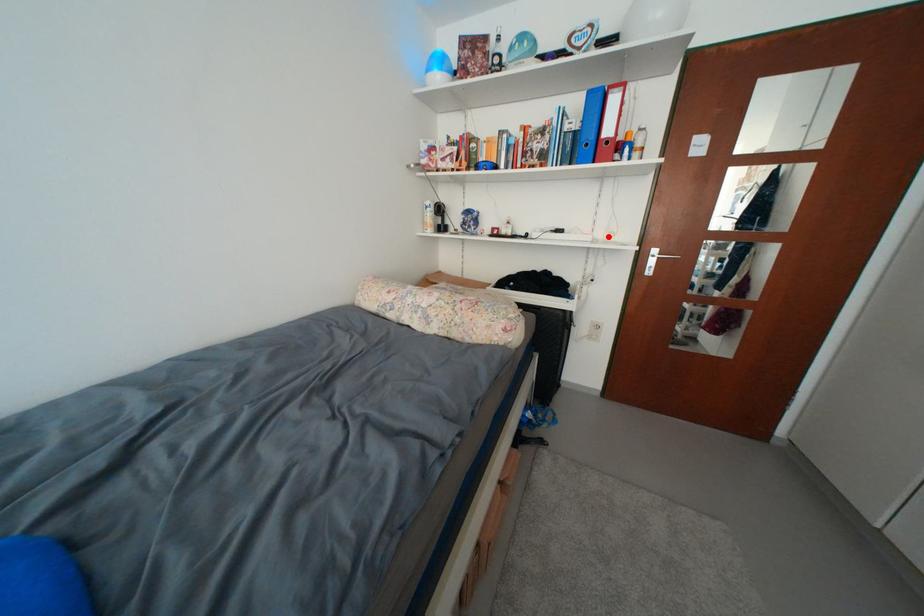
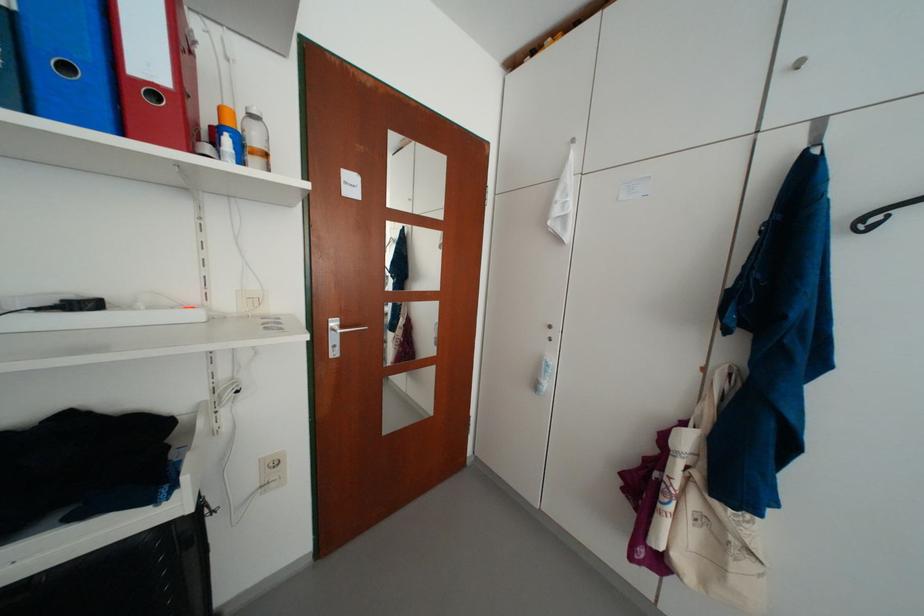
In the second image, find the point that corresponds to the highlighted location in the first image.

(236, 306)